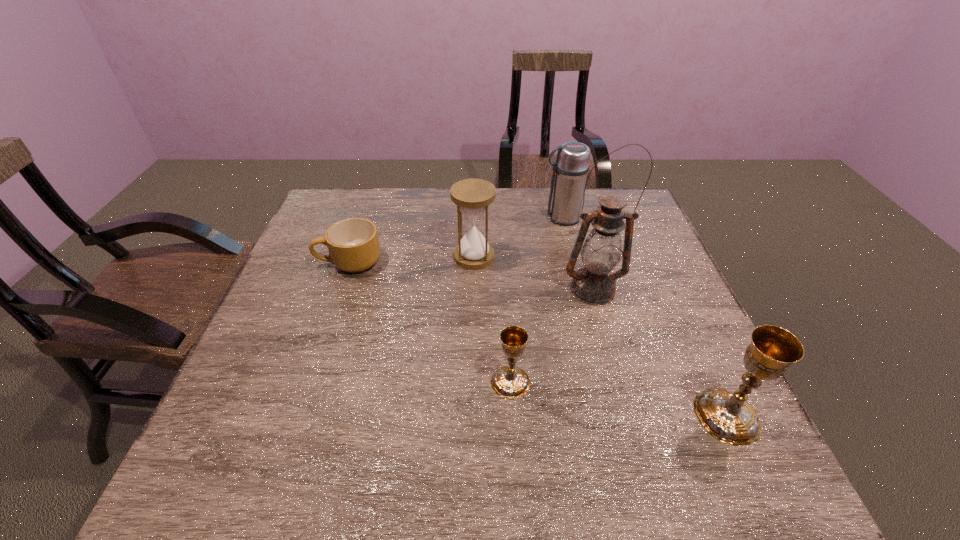
Please point a vacant point for placing a chalice on the left. Please provide its 2D coordinates. Your answer should be formatted as a tuple, i.e. [(x, y)], where the tuple contains the x and y coordinates of a point satisfying the conditions above.

[(320, 352)]